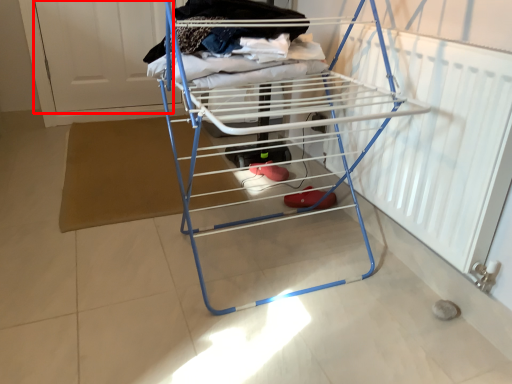
Question: From the image's perspective, considering the relative positions of screen door (annotated by the red box) and furniture in the image provided, where is screen door (annotated by the red box) located with respect to the staircase?

Choices:
 (A) above
 (B) below

Answer: (A)